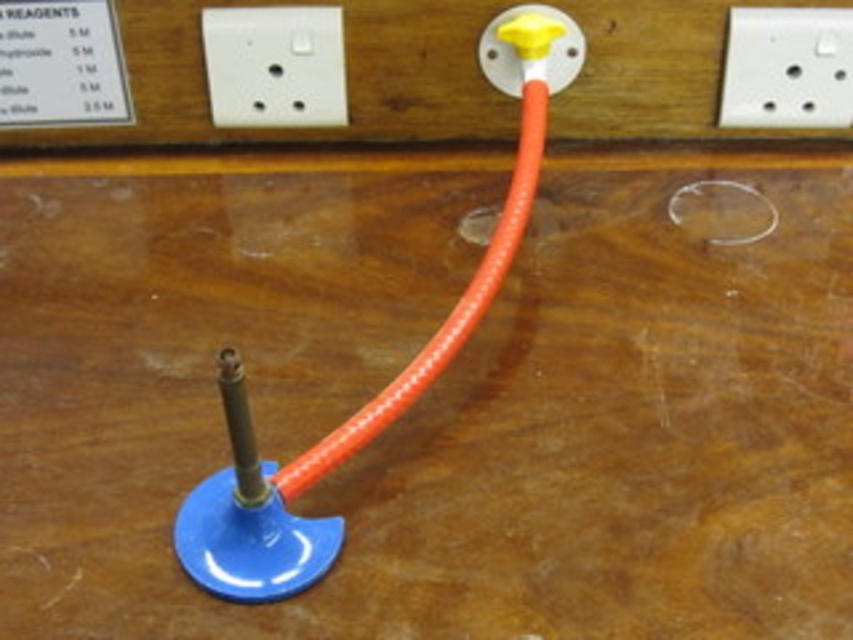
Question: Is white plastic socket at upper center in front of yellow plastic knob at upper center?

Choices:
 (A) yes
 (B) no

Answer: (B)

Question: Does white plastic socket at upper center have a smaller size compared to white plastic socket at upper right?

Choices:
 (A) yes
 (B) no

Answer: (A)

Question: Which point is closer to the camera?

Choices:
 (A) (514, 54)
 (B) (216, 100)

Answer: (A)

Question: Is the position of white plastic socket at upper center more distant than that of yellow plastic knob at upper center?

Choices:
 (A) yes
 (B) no

Answer: (A)

Question: Which is nearer to the white plastic socket at upper center?

Choices:
 (A) white plastic socket at upper right
 (B) yellow plastic knob at upper center

Answer: (B)

Question: Based on their relative distances, which object is farther from the yellow plastic knob at upper center?

Choices:
 (A) white plastic socket at upper right
 (B) white plastic socket at upper center

Answer: (A)